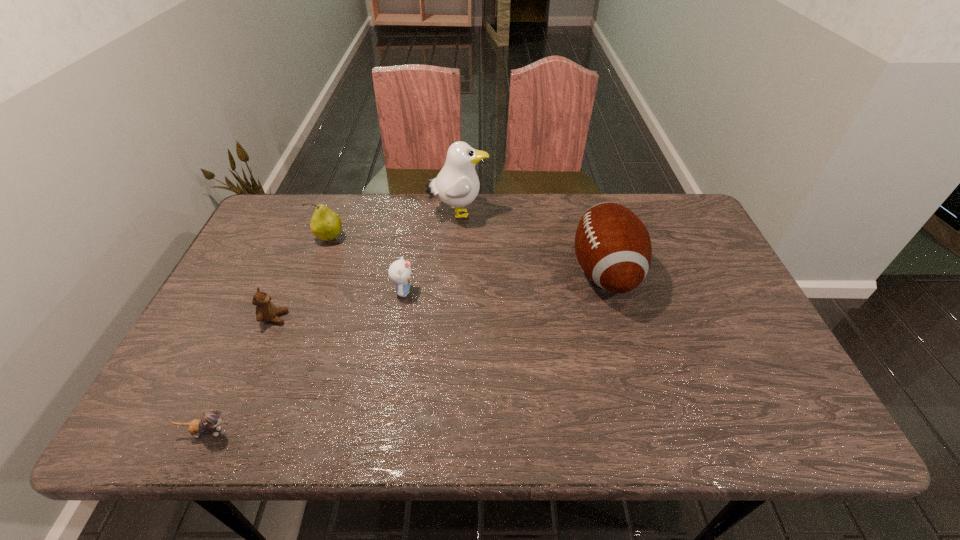
At what (x,y) coordinates should I click in order to perform the action: click on the tallest object. Please return your answer as a coordinate pair (x, y). This screenshot has width=960, height=540. Looking at the image, I should click on (457, 184).

Find the location of a particular element. the second object from right to left is located at coordinates (457, 184).

Where is `the fifth shortest object`? The height and width of the screenshot is (540, 960). the fifth shortest object is located at coordinates (613, 247).

You are a GUI agent. You are given a task and a screenshot of the screen. Output one action in this format:
    pyautogui.click(x=<x>, y=<y>)
    Task: Click on the rightmost object
    The image size is (960, 540).
    Given the screenshot: What is the action you would take?
    pyautogui.click(x=613, y=247)

Find the location of a particular element. This screenshot has width=960, height=540. pear is located at coordinates (325, 224).

At what (x,y) coordinates should I click in order to perform the action: click on the fourth object from left to right. Please return your answer as a coordinate pair (x, y). The height and width of the screenshot is (540, 960). Looking at the image, I should click on (399, 271).

Image resolution: width=960 pixels, height=540 pixels. In order to click on the right kitten in this screenshot , I will do `click(399, 271)`.

Identify the location of teddy bear. The image size is (960, 540). (265, 310).

The width and height of the screenshot is (960, 540). Identify the location of the shorter kitten. (211, 419).

At what (x,y) coordinates should I click in order to perform the action: click on the nearer kitten. Please return your answer as a coordinate pair (x, y). Looking at the image, I should click on (211, 419).